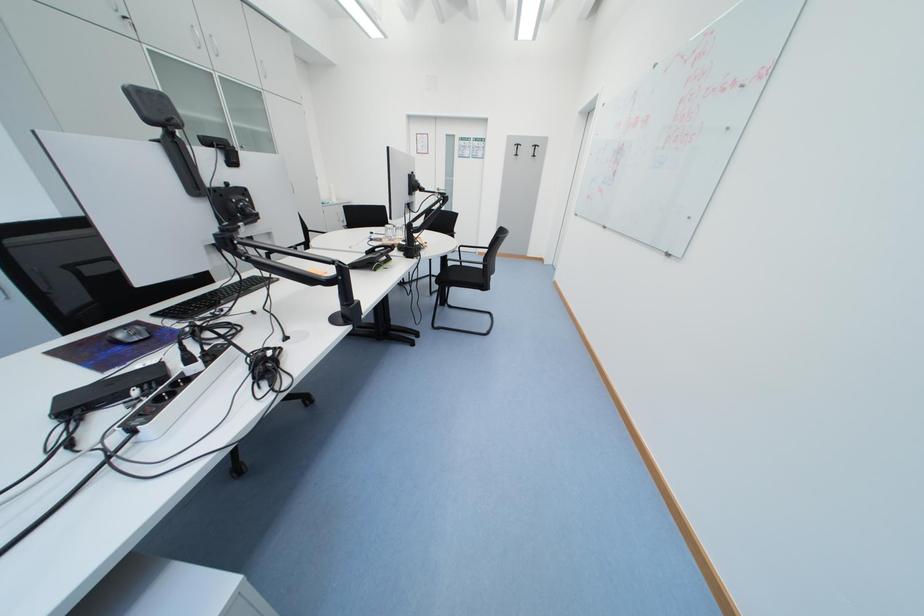
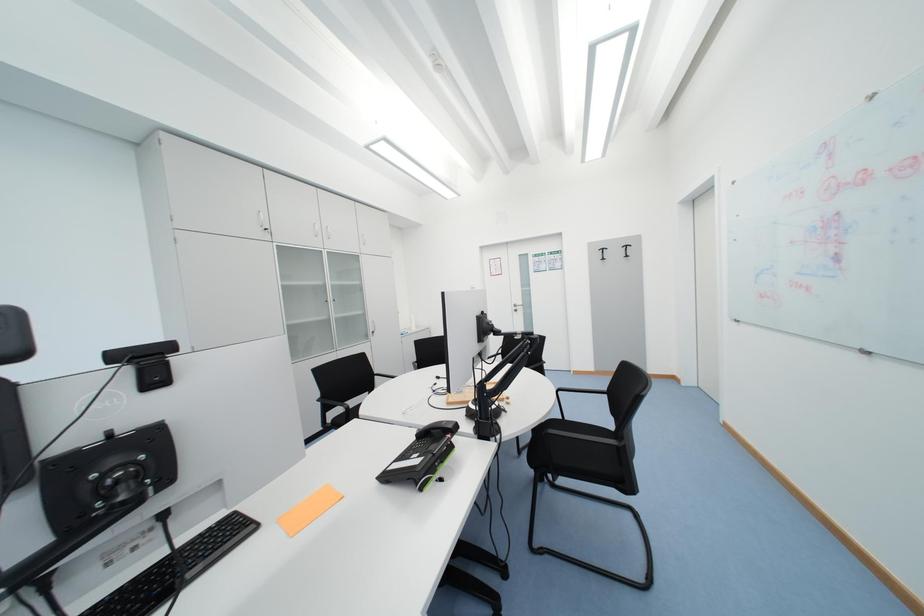
Based on the continuous images, in which direction is the camera rotating?

The camera rotated toward left-up.